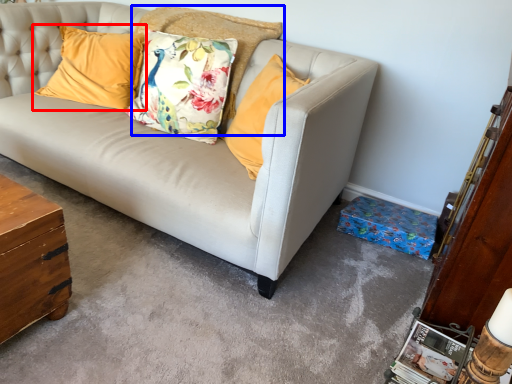
Question: Which object is closer to the camera taking this photo, pillow (highlighted by a red box) or pillow (highlighted by a blue box)?

Choices:
 (A) pillow
 (B) pillow

Answer: (B)